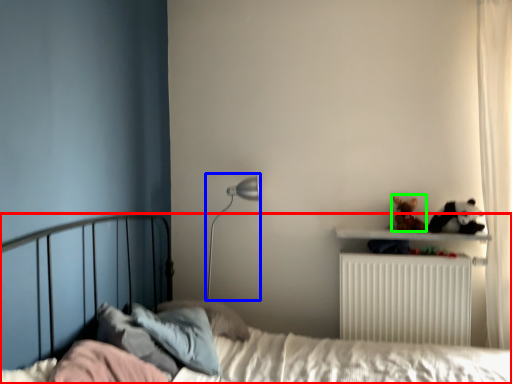
Question: Considering the real-world distances, which object is farthest from bed (highlighted by a red box)? table lamp (highlighted by a blue box) or toy (highlighted by a green box)?

Choices:
 (A) table lamp
 (B) toy

Answer: (A)